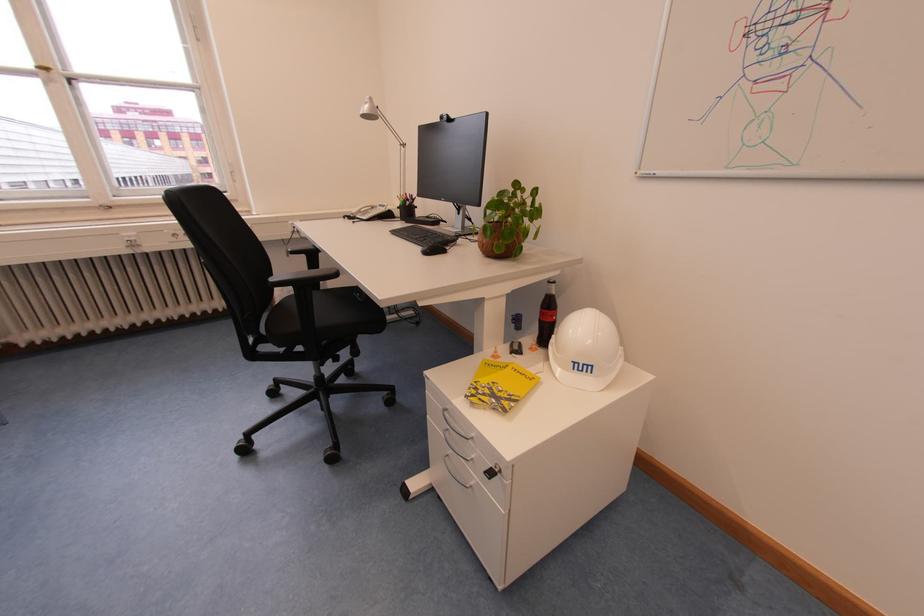
Describe the element at coordinates (327, 317) in the screenshot. I see `the chair sitting surface` at that location.